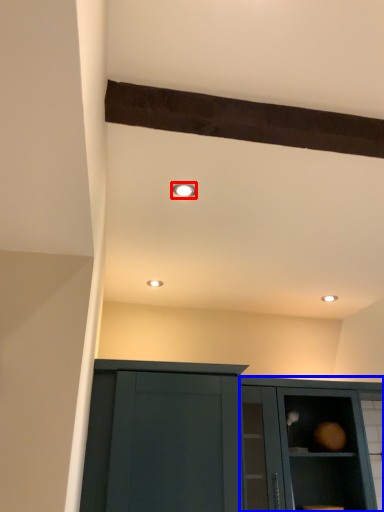
Question: Which object appears closest to the camera in this image, lighting (highlighted by a red box) or cabinetry (highlighted by a blue box)?

Choices:
 (A) lighting
 (B) cabinetry

Answer: (A)